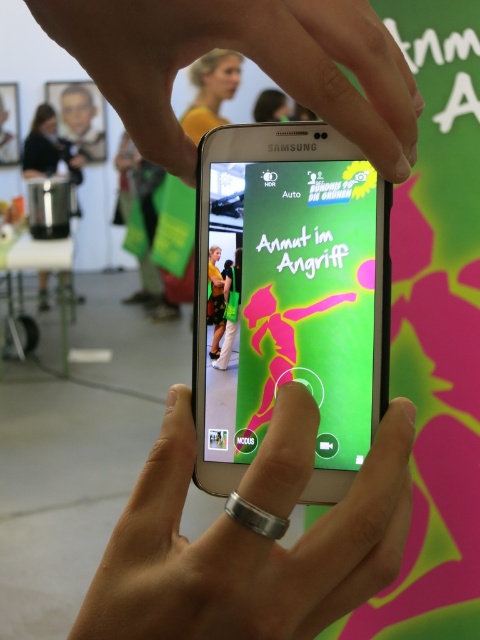
Question: Which point is farther to the camera?

Choices:
 (A) (282, 100)
 (B) (75, 164)

Answer: (B)

Question: Which object is farther from the camera taking this photo?

Choices:
 (A) matte silver phone at center
 (B) silver metallic ring at center

Answer: (A)

Question: Among these points, which one is nearest to the camera?

Choices:
 (A) (147, 570)
 (B) (223, 360)
 (C) (75, 97)
 (D) (257, 112)

Answer: (A)

Question: Is yellow t-shirt at upper center below smooth skin face at upper center?

Choices:
 (A) no
 (B) yes

Answer: (B)

Question: Can you confirm if silver metallic ring at center is thinner than green fabric pants at center?

Choices:
 (A) yes
 (B) no

Answer: (B)

Question: Does yellow t-shirt at upper center have a lesser width compared to green fabric pants at center?

Choices:
 (A) yes
 (B) no

Answer: (B)